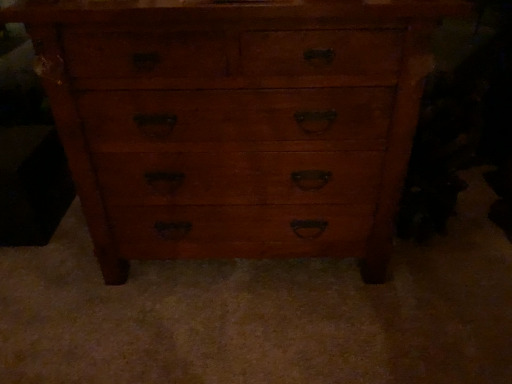
Find the location of `wooden chest of drawers at center`. wooden chest of drawers at center is located at coordinates (236, 122).

Describe the element at coordinates (236, 122) in the screenshot. I see `wooden chest of drawers at center` at that location.

At what (x,y) coordinates should I click in order to perform the action: click on wooden chest of drawers at center. Please return your answer as a coordinate pair (x, y). The height and width of the screenshot is (384, 512). Looking at the image, I should click on click(236, 122).